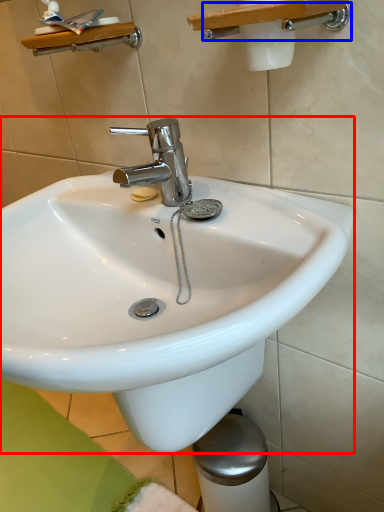
Question: Which of the following is the closest to the observer, sink (highlighted by a red box) or shower (highlighted by a blue box)?

Choices:
 (A) sink
 (B) shower

Answer: (A)